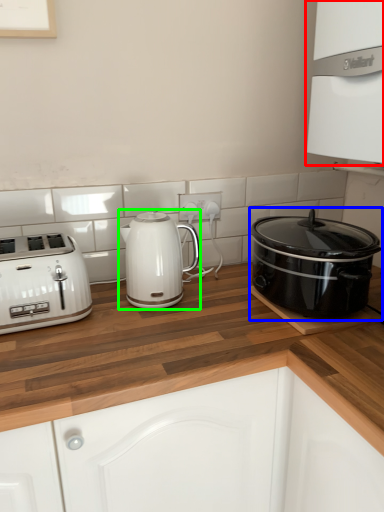
Question: Based on their relative distances, which object is farther from oven (highlighted by a red box)? Choose from slow cooker (highlighted by a blue box) and kettle (highlighted by a green box).

Choices:
 (A) slow cooker
 (B) kettle

Answer: (B)